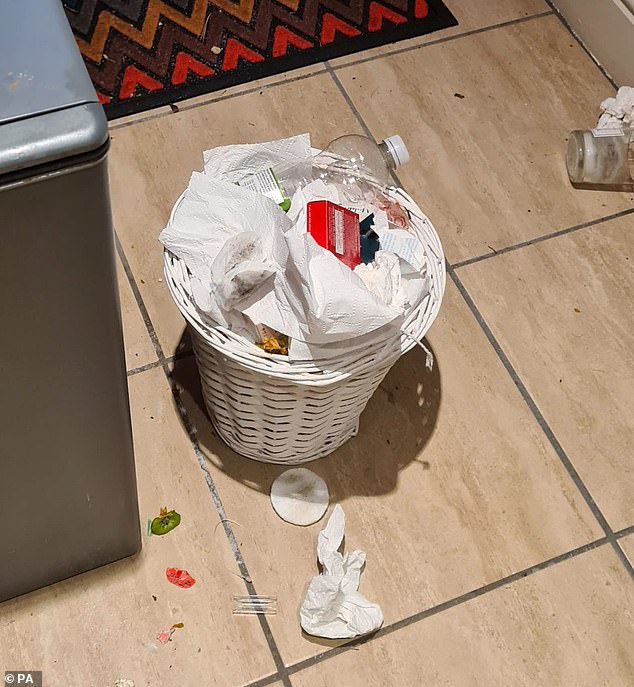
Where is `bare tiles`? bare tiles is located at coordinates (275, 679), (507, 655), (626, 550), (586, 352).